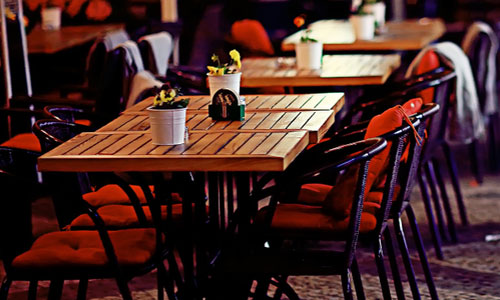
What are the coordinates of `potted plants` in the screenshot? It's located at (172, 115), (223, 77), (303, 57), (365, 21), (378, 6).